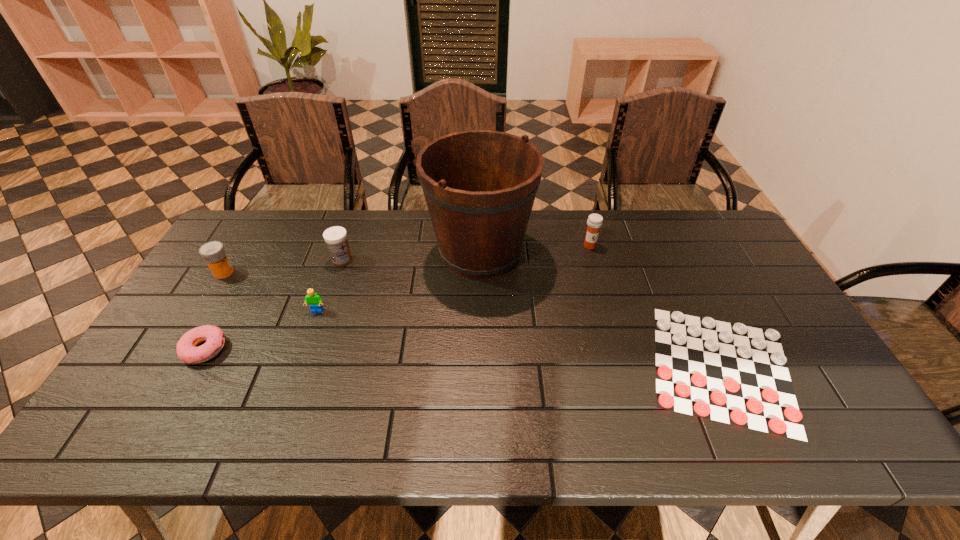
I want to click on vacant space in between the leftmost medicine and the sixth tallest object, so click(x=214, y=311).

Identify the location of vacant area that lies between the second medicine from right to left and the shortest object. The height and width of the screenshot is (540, 960). (532, 314).

You are a GUI agent. You are given a task and a screenshot of the screen. Output one action in this format:
    pyautogui.click(x=<x>, y=<y>)
    Task: Click on the free point between the leftmost medicine and the second medicine from right to left
    The width and height of the screenshot is (960, 540).
    Given the screenshot: What is the action you would take?
    pyautogui.click(x=283, y=266)

Where is `free area in between the second medicine from left to right and the doughnut`? This screenshot has height=540, width=960. free area in between the second medicine from left to right and the doughnut is located at coordinates (274, 305).

I want to click on empty location between the fifth tallest object and the rightmost object, so click(x=519, y=339).

At what (x,y) coordinates should I click in order to perform the action: click on unoccupied position between the fifth tallest object and the sixth object from left to right. Please return your answer as a coordinate pair (x, y). This screenshot has height=540, width=960. Looking at the image, I should click on (453, 279).

What are the coordinates of `blank region between the farthest medicine and the tallest object` in the screenshot? It's located at (535, 249).

You are a GUI agent. You are given a task and a screenshot of the screen. Output one action in this format:
    pyautogui.click(x=<x>, y=<y>)
    Task: Click on the vacant space in between the rightmost object and the second medicine from left to right
    
    Given the screenshot: What is the action you would take?
    pyautogui.click(x=532, y=314)

At what (x,y) coordinates should I click in order to perform the action: click on vacant space that's between the shortest object and the sixth tallest object. Please return your answer as a coordinate pair (x, y). The image size is (960, 540). Looking at the image, I should click on (463, 358).

Locate which object ranks fifth in proximity to the shortest object. Please provide its 2D coordinates. Your answer should be formatted as a tuple, i.e. [(x, y)], where the tuple contains the x and y coordinates of a point satisfying the conditions above.

[(187, 351)]